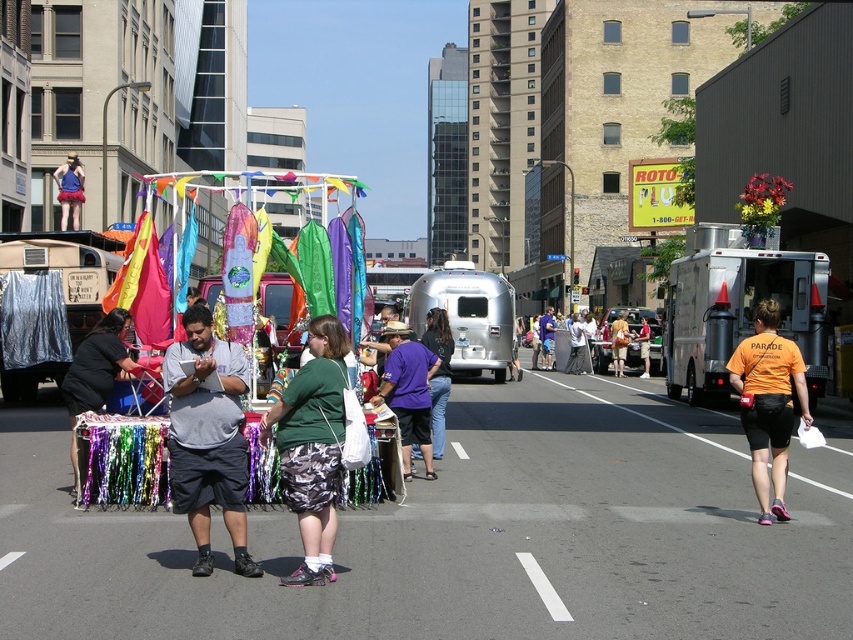
Describe the element at coordinates (468, 316) in the screenshot. Image resolution: width=853 pixels, height=640 pixels. I see `silver metallic trailer at center` at that location.

Does point (456, 330) lie behind point (77, 205)?

No, it is not.

At what (x,y) coordinates should I click in order to perform the action: click on silver metallic trailer at center. Please return your answer as a coordinate pair (x, y). Looking at the image, I should click on (468, 316).

From the picture: Who is taller, gray fabric stall at center or silver metallic trailer at center?

With more height is silver metallic trailer at center.

This screenshot has height=640, width=853. In order to click on gray fabric stall at center in this screenshot , I will do `click(207, 438)`.

Describe the element at coordinates (312, 445) in the screenshot. I see `camouflage shorts at center` at that location.

Does point (306, 483) come closer to viewer compared to point (67, 218)?

Yes, it is.

Find the location of `camouflage shorts at center`. camouflage shorts at center is located at coordinates (312, 445).